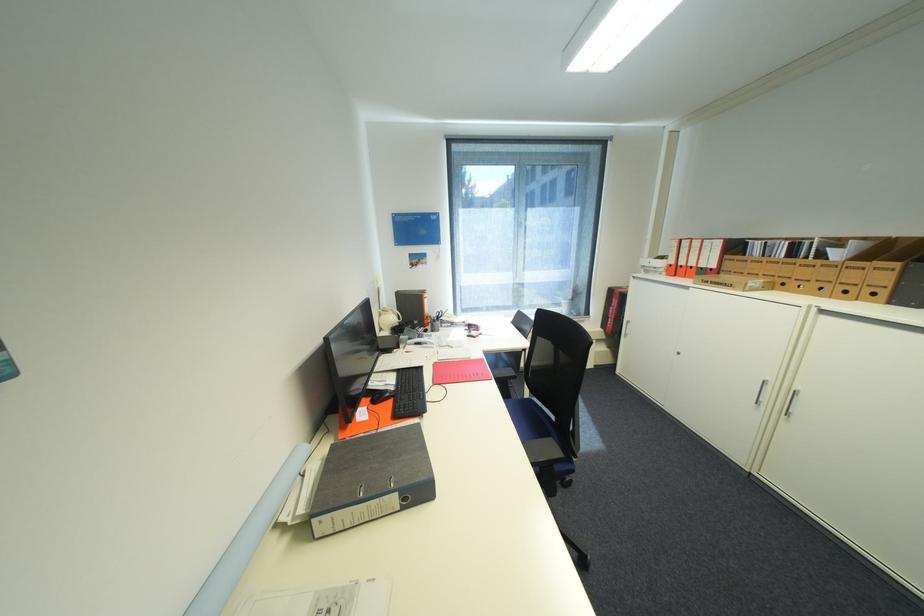
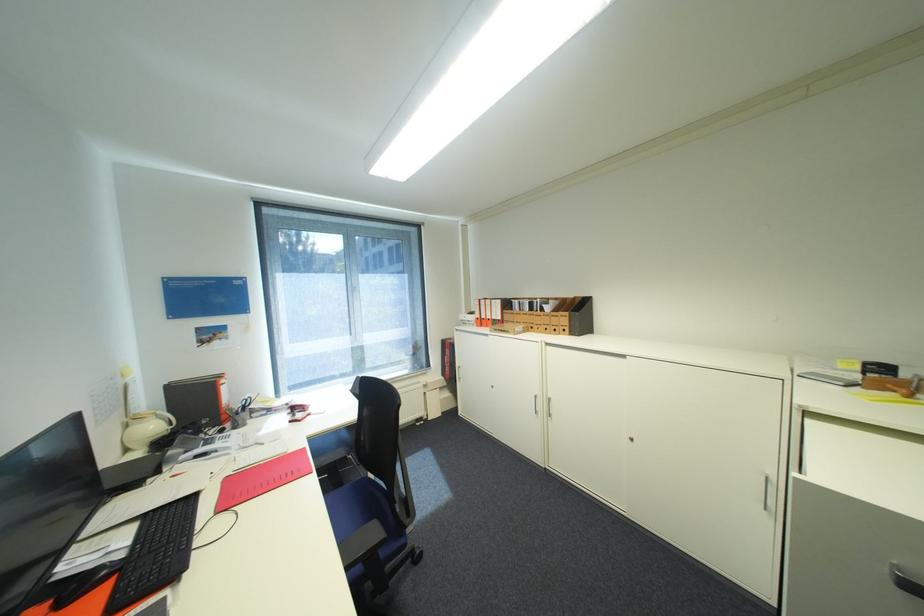
In the second image, find the point that corresponds to (x=545, y=469) in the first image.

(367, 569)